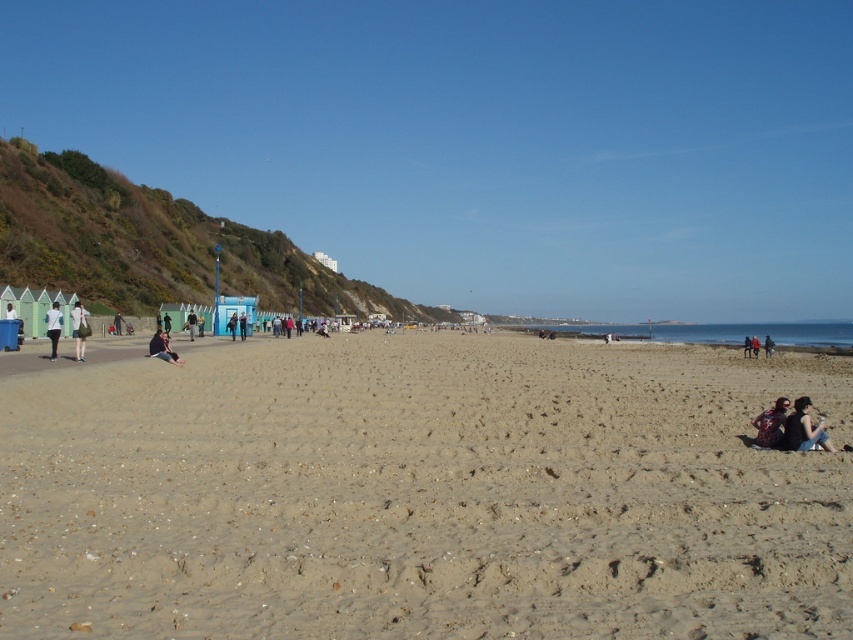
You are standing at the beach and want to locate two points marked on the sand. The first point is at coordinates point (424, 413), and the second is at point (744, 339). Which point is closer to you?

Point (424, 413) is closer to the viewer than point (744, 339).

You are standing on the beach and want to walk to the smooth sand at center. However, there is a white matte jacket at left in your path. Can you walk around the jacket to reach the sand?

The smooth sand at center is in front of the white matte jacket at left, meaning the jacket is closer to you. To reach the sand, you would need to move the jacket or navigate around it since it is blocking your direct path.

You are standing on the beach and want to place a small beach umbrella exactly at the smooth sand at center. According to the coordinates provided, where should you place it?

The smooth sand at center is located at point [421,493], so you should place the beach umbrella there.